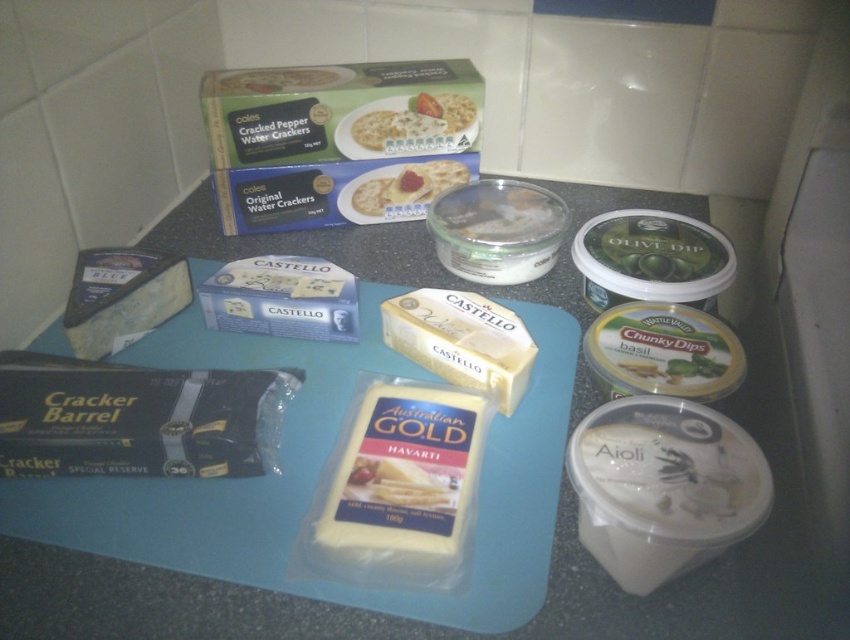
In the scene shown: Is white creamy havarti at center above blue creamy cheese at lower left?

No, white creamy havarti at center is not above blue creamy cheese at lower left.

Between white creamy havarti at center and blue creamy cheese at lower left, which one appears on the right side from the viewer's perspective?

white creamy havarti at center

Locate an element on the screen. The width and height of the screenshot is (850, 640). white creamy havarti at center is located at coordinates (401, 483).

Is point (627, 433) in front of point (455, 93)?

Yes, it is.

Can you confirm if white creamy aioli at bottom right is positioned below white cracker at upper center?

Indeed, white creamy aioli at bottom right is positioned under white cracker at upper center.

Is point (697, 532) positioned before point (382, 106)?

Yes, point (697, 532) is in front of point (382, 106).

Locate an element on the screen. white creamy aioli at bottom right is located at coordinates (664, 490).

Is blue plastic cutting board at center to the left of white cracker at upper center from the viewer's perspective?

Indeed, blue plastic cutting board at center is positioned on the left side of white cracker at upper center.

Who is higher up, blue plastic cutting board at center or white cracker at upper center?

white cracker at upper center is above.

Is point (171, 234) positioned after point (446, 124)?

Yes.

Identify the location of blue plastic cutting board at center. (156, 604).